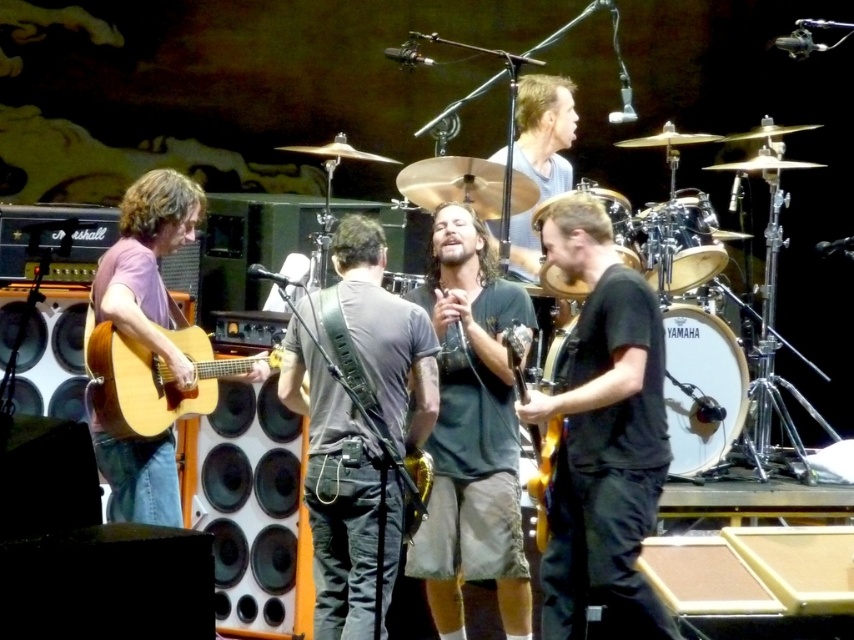
Does dark gray t-shirt at center have a smaller size compared to black drum at center?

Actually, dark gray t-shirt at center might be larger than black drum at center.

The image size is (854, 640). Find the location of `dark gray t-shirt at center`. dark gray t-shirt at center is located at coordinates (471, 433).

I want to click on dark gray t-shirt at center, so click(x=471, y=433).

Is white drumhead at center behind black drum at center?

That is True.

Can you confirm if white drumhead at center is positioned to the left of black drum at center?

No, white drumhead at center is not to the left of black drum at center.

Does point (730, 444) come closer to viewer compared to point (682, 208)?

No, (730, 444) is behind (682, 208).

Identify the location of white drumhead at center. (700, 388).

Who is lower down, yamaha drum at center or smooth gray shirt at upper center?

Positioned lower is yamaha drum at center.

Is yamaha drum at center thinner than smooth gray shirt at upper center?

Yes, yamaha drum at center is thinner than smooth gray shirt at upper center.

Between point (724, 337) and point (519, 268), which one is positioned behind?

Positioned behind is point (519, 268).

Identify the location of yamaha drum at center. The height and width of the screenshot is (640, 854). (700, 388).